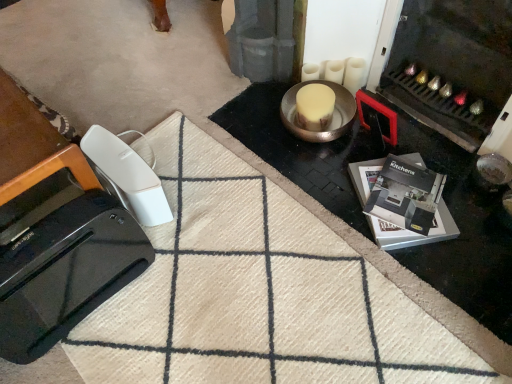
I want to click on free location above beige woolen doormat at lower left (from a real-world perspective), so click(223, 285).